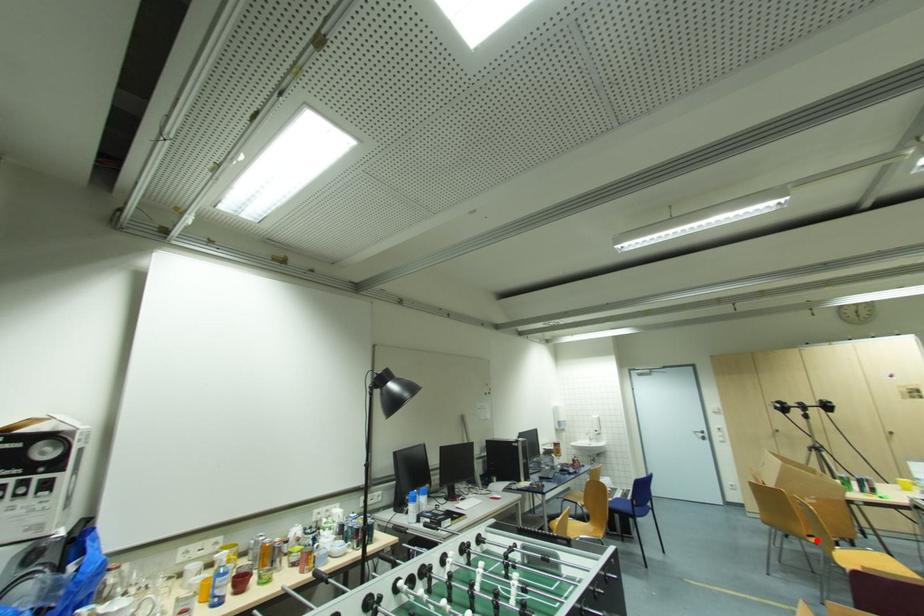
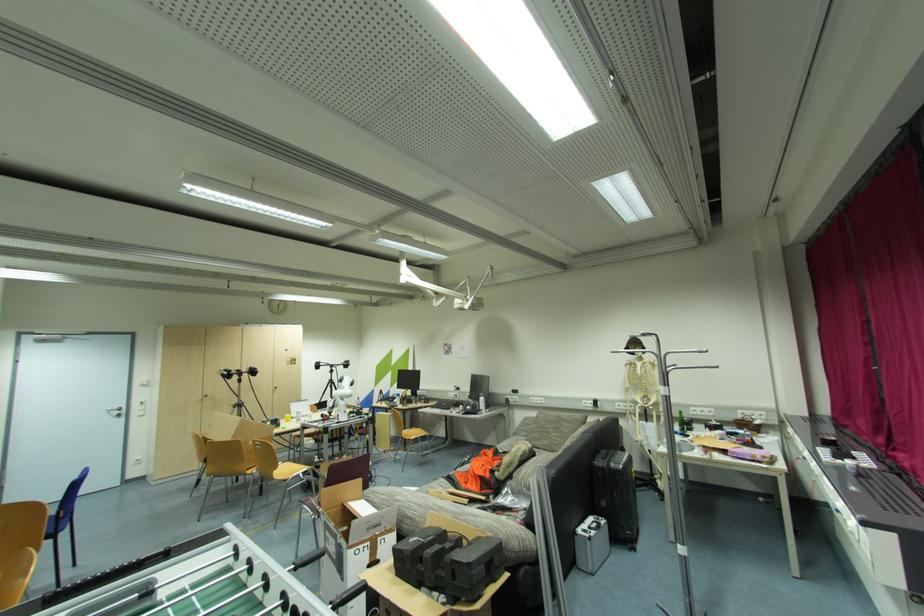
In the second image, find the point that corresponds to the highlighted location in the first image.

(252, 472)